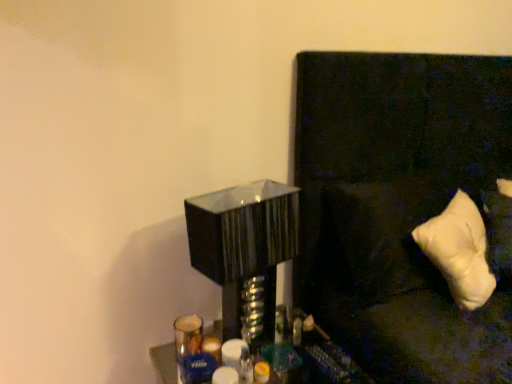
Question: Is glossy black table lamp at center thinner than white soft pillow at right?

Choices:
 (A) no
 (B) yes

Answer: (B)

Question: Is glossy black table lamp at center turned away from white soft pillow at right?

Choices:
 (A) no
 (B) yes

Answer: (A)

Question: From the image's perspective, does glossy black table lamp at center appear higher than white soft pillow at right?

Choices:
 (A) no
 (B) yes

Answer: (A)

Question: Considering the relative sizes of glossy black table lamp at center and white soft pillow at right in the image provided, is glossy black table lamp at center wider than white soft pillow at right?

Choices:
 (A) no
 (B) yes

Answer: (A)

Question: Is there a large distance between glossy black table lamp at center and white soft pillow at right?

Choices:
 (A) yes
 (B) no

Answer: (B)

Question: Can you confirm if glossy black table lamp at center is shorter than white soft pillow at right?

Choices:
 (A) no
 (B) yes

Answer: (A)

Question: Can you confirm if white soft pillow at right is shorter than glossy black table lamp at center?

Choices:
 (A) no
 (B) yes

Answer: (A)

Question: Is glossy black table lamp at center completely or partially inside white soft pillow at right?

Choices:
 (A) no
 (B) yes

Answer: (A)

Question: Does white soft pillow at right have a greater width compared to glossy black table lamp at center?

Choices:
 (A) no
 (B) yes

Answer: (B)

Question: Is white soft pillow at right behind glossy black table lamp at center?

Choices:
 (A) yes
 (B) no

Answer: (A)

Question: Is white soft pillow at right touching glossy black table lamp at center?

Choices:
 (A) no
 (B) yes

Answer: (A)

Question: Is white soft pillow at right oriented away from glossy black table lamp at center?

Choices:
 (A) yes
 (B) no

Answer: (B)

Question: Is glossy black table lamp at center smaller than white soft pillow at right?

Choices:
 (A) yes
 (B) no

Answer: (A)